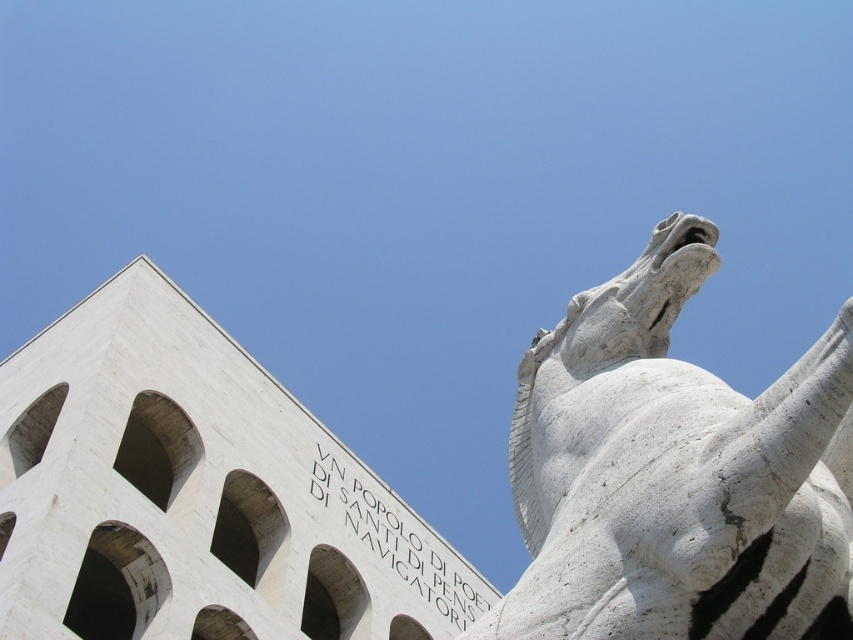
You are standing at a point 20.08 meters away from the point marked at coordinates point (674, 406). Given the scene described, what might be the significance of this point in relation to the architectural structure or the sculpture?

The point marked at coordinates point (674, 406) is 20.08 meters away from the viewer, which could indicate it is a focal point in the architectural design or a strategic viewing point for the white sculpture of a horse in mid gallop.

You are an art student analyzing the image. You notice the white marble horse at upper right and the white stone text at upper center. Which object has a greater width when viewed from your perspective?

The white stone text at upper center is wider than the white marble horse at upper right.